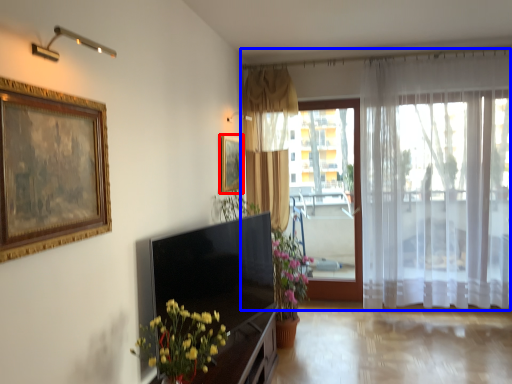
Question: Which object appears closest to the camera in this image, picture frame (highlighted by a red box) or curtain (highlighted by a blue box)?

Choices:
 (A) picture frame
 (B) curtain

Answer: (A)